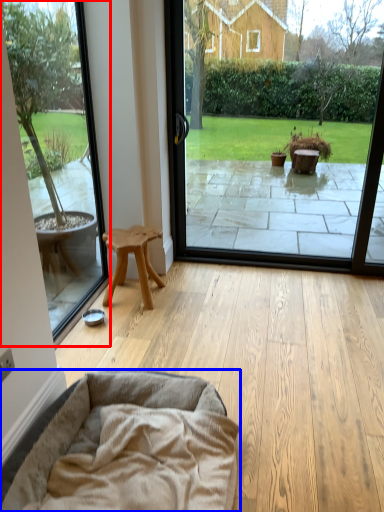
Question: Which point is closer to the camera, window screen (highlighted by a red box) or dog bed (highlighted by a blue box)?

Choices:
 (A) window screen
 (B) dog bed

Answer: (B)